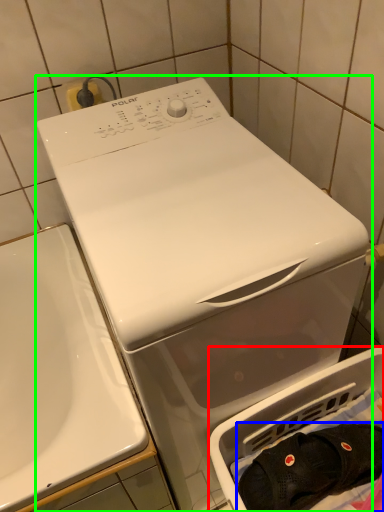
Question: Which object is the farthest from dish washer (highlighted by a red box)? Choose among these: clothing (highlighted by a blue box) or washing machine (highlighted by a green box).

Choices:
 (A) clothing
 (B) washing machine

Answer: (B)